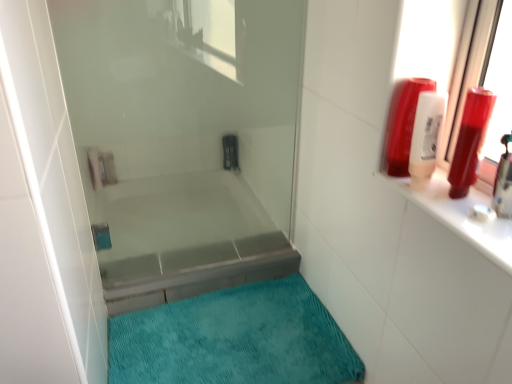
Question: In the image, is transparent glass shower door at center positioned in front of or behind matte plastic shampoo bottle at upper right, which is counted as the first toiletry, starting from the left?

Choices:
 (A) behind
 (B) front

Answer: (A)

Question: Looking at their shapes, would you say transparent glass shower door at center is wider or thinner than matte plastic shampoo bottle at upper right, which is counted as the first toiletry, starting from the left?

Choices:
 (A) thin
 (B) wide

Answer: (A)

Question: Based on their relative distances, which object is farther from the teal plush bath mat at lower center?

Choices:
 (A) shiny plastic bottle at upper right, placed as the 3th toiletry when sorted from left to right
 (B) translucent plastic shampoo bottle at upper right, placed as the 2th toiletry when sorted from right to left
 (C) transparent glass shower door at center
 (D) metallic silver bathtub at center
 (E) matte plastic shampoo bottle at upper right, which is counted as the first toiletry, starting from the left

Answer: (A)

Question: Which object is positioned closest to the matte plastic shampoo bottle at upper right, which is counted as the first toiletry, starting from the left?

Choices:
 (A) shiny plastic bottle at upper right, the 1th toiletry from the right
 (B) transparent glass shower door at center
 (C) translucent plastic shampoo bottle at upper right, placed as the 2th toiletry when sorted from right to left
 (D) teal plush bath mat at lower center
 (E) metallic silver bathtub at center

Answer: (C)